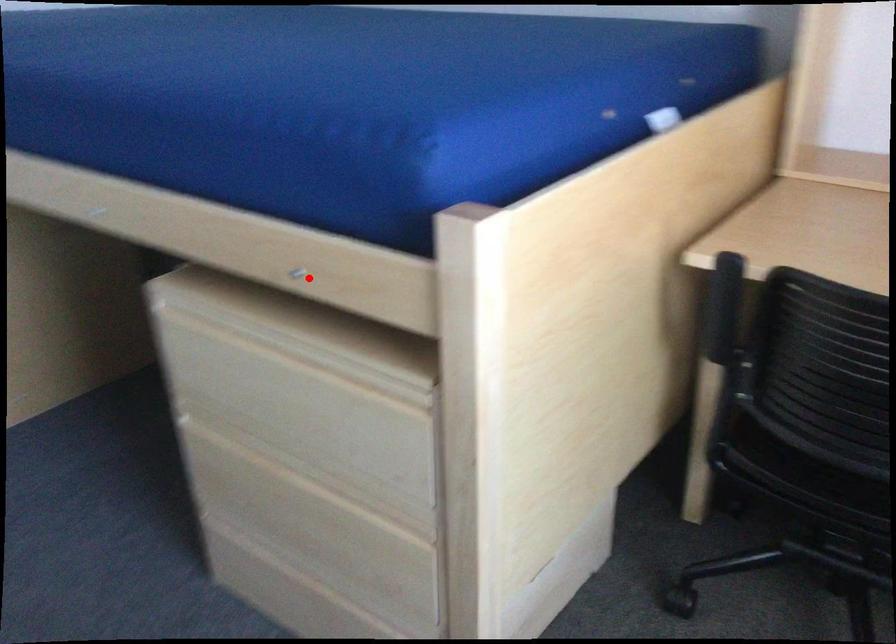
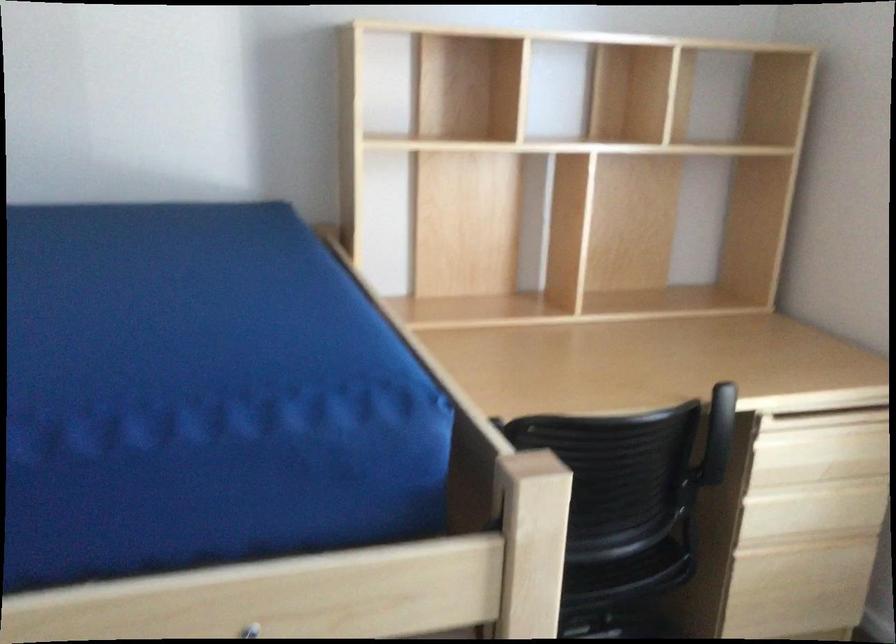
Question: I am providing you with two images of the same scene from different viewpoints. Image1 has a red point marked. In image2, the corresponding 3D location appears at what relative position? Reply with the corresponding letter.

Choices:
 (A) Closer
 (B) Farther

Answer: (A)